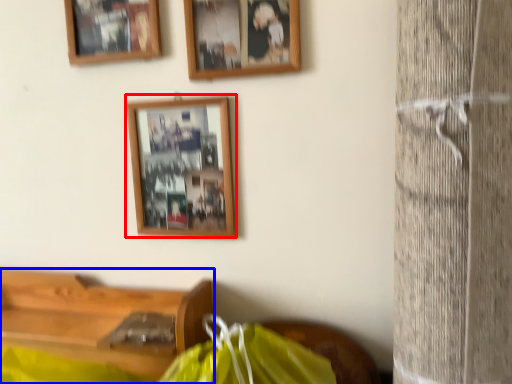
Question: Which of the following is the farthest to the observer, picture frame (highlighted by a red box) or furniture (highlighted by a blue box)?

Choices:
 (A) picture frame
 (B) furniture

Answer: (A)